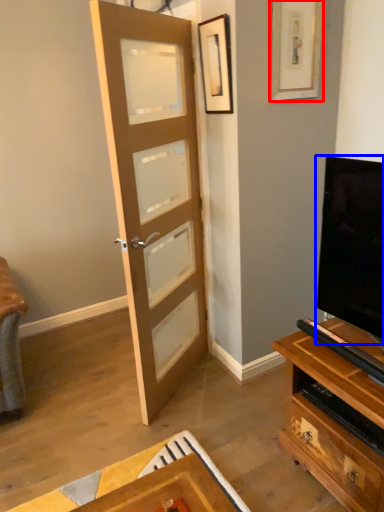
Question: Which object appears farthest to the camera in this image, picture frame (highlighted by a red box) or television (highlighted by a blue box)?

Choices:
 (A) picture frame
 (B) television

Answer: (B)